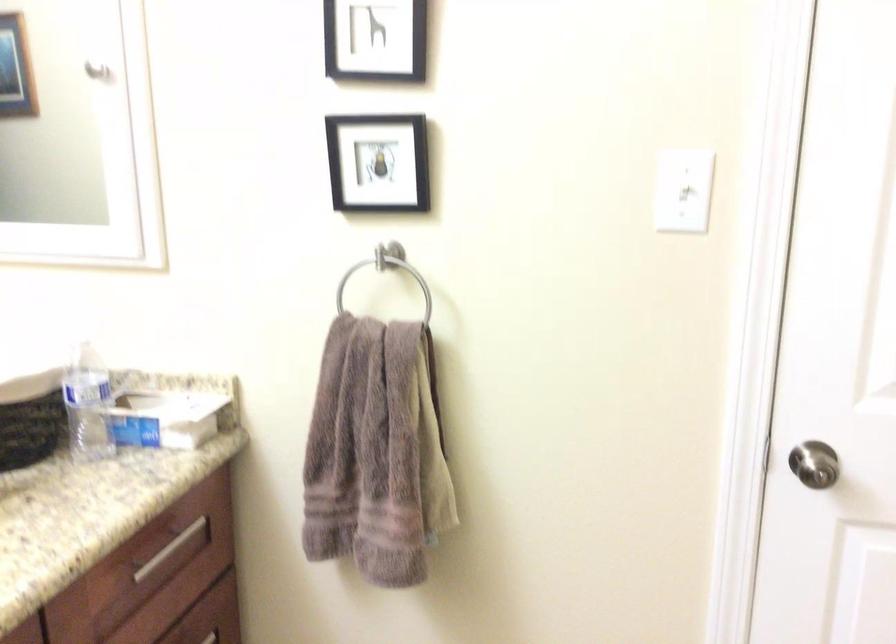
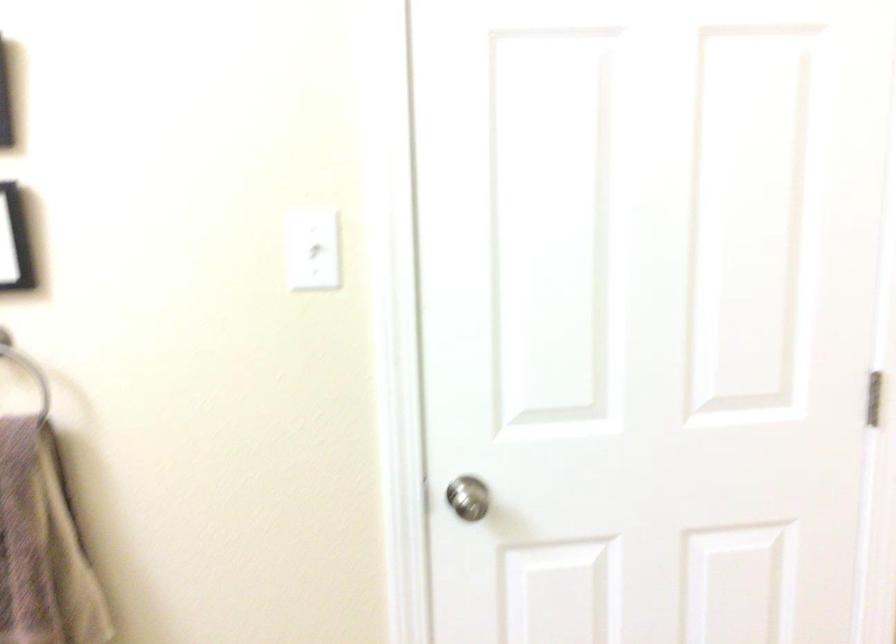
Question: The first image is from the beginning of the video and the second image is from the end. How did the camera likely rotate when shooting the video?

Choices:
 (A) Left
 (B) Right
 (C) Up
 (D) Down

Answer: (B)